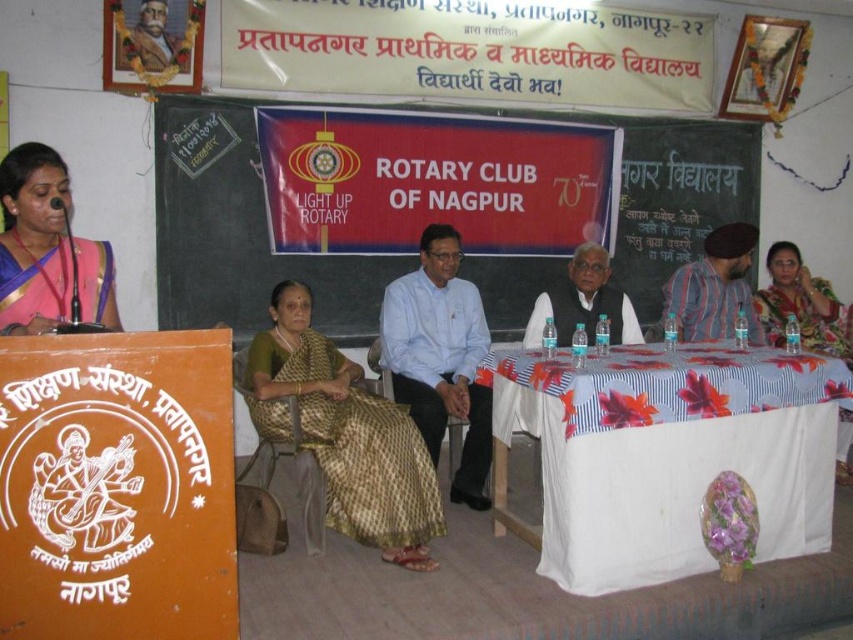
Image resolution: width=853 pixels, height=640 pixels. What do you see at coordinates (714, 288) in the screenshot?
I see `striped cotton shirt at center` at bounding box center [714, 288].

Who is positioned more to the left, striped cotton shirt at center or painted portrait of man at upper left?

Positioned to the left is painted portrait of man at upper left.

What do you see at coordinates (714, 288) in the screenshot? This screenshot has width=853, height=640. I see `striped cotton shirt at center` at bounding box center [714, 288].

Locate an element on the screen. This screenshot has width=853, height=640. striped cotton shirt at center is located at coordinates (714, 288).

Which is above, gold brocade saree at center or light blue shirt at center?

light blue shirt at center is higher up.

Is point (392, 429) positioned in front of point (457, 380)?

That is True.

The image size is (853, 640). I want to click on gold brocade saree at center, so click(x=345, y=435).

Who is taller, pink silk saree at left or floral saree at right?

Standing taller between the two is floral saree at right.

What do you see at coordinates (47, 250) in the screenshot?
I see `pink silk saree at left` at bounding box center [47, 250].

The width and height of the screenshot is (853, 640). Find the location of `pink silk saree at left`. pink silk saree at left is located at coordinates (47, 250).